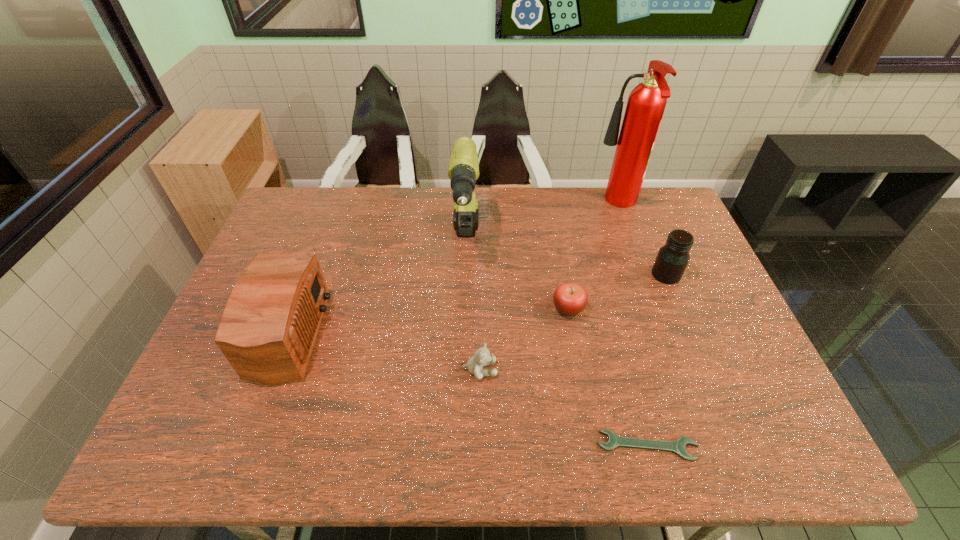
Locate an element on the screen. The width and height of the screenshot is (960, 540). object that is at the near edge is located at coordinates (678, 446).

Where is `object at the left edge`? The width and height of the screenshot is (960, 540). object at the left edge is located at coordinates (269, 325).

Identify the location of fire extinguisher located in the right edge section of the desktop. The image size is (960, 540). (646, 103).

Locate an element on the screen. jar situated at the right edge is located at coordinates (672, 259).

This screenshot has height=540, width=960. I want to click on object situated at the far right corner, so click(x=646, y=103).

Where is `vacant space at the far edge`? The height and width of the screenshot is (540, 960). vacant space at the far edge is located at coordinates (396, 200).

In the image, there is a desktop. Identify the location of blank space at the near edge. The height and width of the screenshot is (540, 960). tap(699, 460).

You are a GUI agent. You are given a task and a screenshot of the screen. Output one action in this format:
    pyautogui.click(x=<x>, y=<y>)
    Task: Click on the free region at the left edge of the desktop
    This screenshot has width=960, height=540.
    Given the screenshot: What is the action you would take?
    pyautogui.click(x=228, y=386)

You are a GUI agent. You are given a task and a screenshot of the screen. Output one action in this format:
    pyautogui.click(x=<x>, y=<y>)
    Task: Click on the free region at the right edge
    This screenshot has width=960, height=540.
    Given the screenshot: What is the action you would take?
    pyautogui.click(x=729, y=340)

I want to click on vacant region at the far right corner of the desktop, so click(x=676, y=218).